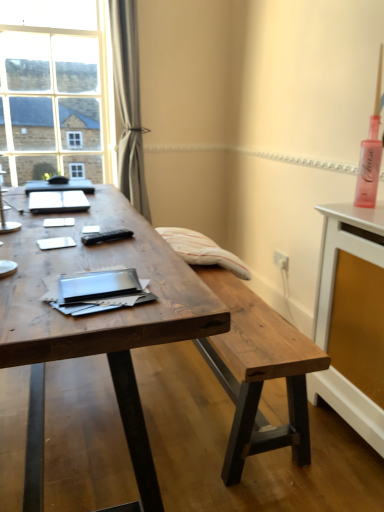
Question: Looking at their shapes, would you say white glossy sideboard at right is wider or thinner than wooden desk at center?

Choices:
 (A) thin
 (B) wide

Answer: (A)

Question: From the image's perspective, is white glossy sideboard at right located above or below wooden desk at center?

Choices:
 (A) above
 (B) below

Answer: (B)

Question: Which object is the closest to the wooden desk at center?

Choices:
 (A) matte black notebook at center
 (B) clear glass window at upper left
 (C) rustic wood bench at center
 (D) satin gray curtain at upper left
 (E) white glossy sideboard at right

Answer: (A)

Question: Which is farther from the satin gray curtain at upper left?

Choices:
 (A) clear glass window at upper left
 (B) matte black notebook at center
 (C) white glossy sideboard at right
 (D) wooden desk at center
 (E) rustic wood bench at center

Answer: (C)